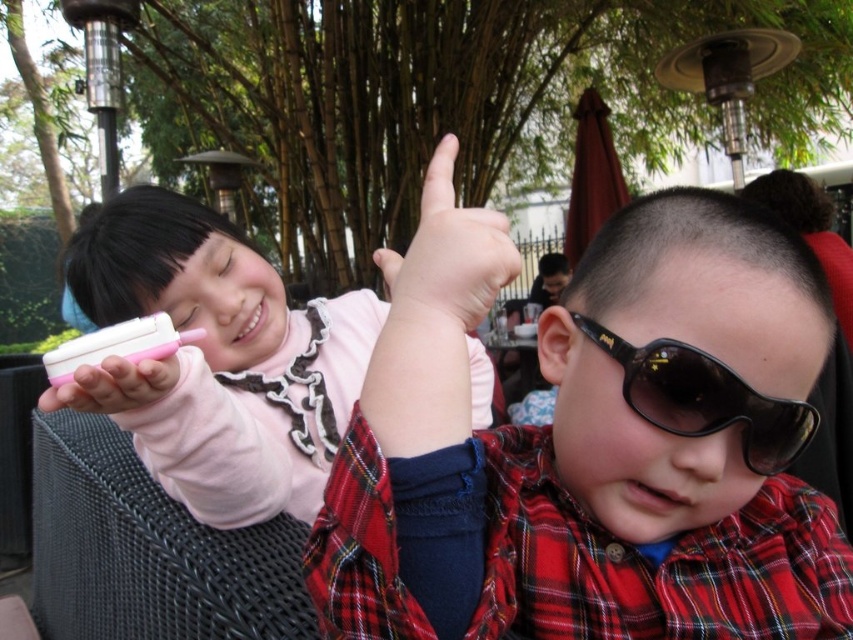
Consider the image. Does plaid shirt at center have a greater height compared to black plastic goggles at center?

Indeed, plaid shirt at center has a greater height compared to black plastic goggles at center.

I want to click on plaid shirt at center, so click(583, 445).

Does green bamboo forest at upper center have a smaller size compared to pink matte phone at upper left?

No, green bamboo forest at upper center is not smaller than pink matte phone at upper left.

Identify the location of green bamboo forest at upper center. (445, 99).

Looking at this image, can you confirm if green bamboo forest at upper center is positioned above pink matte ice cream at center?

Correct, green bamboo forest at upper center is located above pink matte ice cream at center.

In the scene shown: Can you confirm if green bamboo forest at upper center is shorter than pink matte ice cream at center?

In fact, green bamboo forest at upper center may be taller than pink matte ice cream at center.

Where is `green bamboo forest at upper center`? The image size is (853, 640). green bamboo forest at upper center is located at coordinates tap(445, 99).

Where is `green bamboo forest at upper center`? green bamboo forest at upper center is located at coordinates (445, 99).